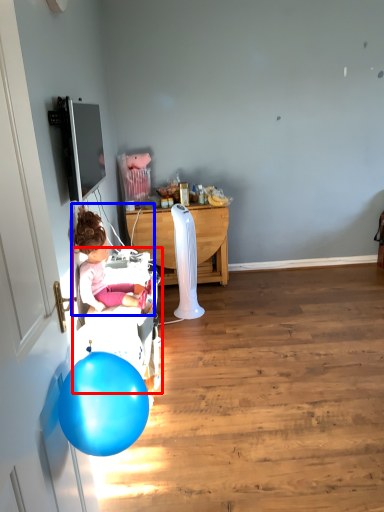
Question: Which object is further to the camera taking this photo, baby carriage (highlighted by a red box) or person (highlighted by a blue box)?

Choices:
 (A) baby carriage
 (B) person

Answer: (A)